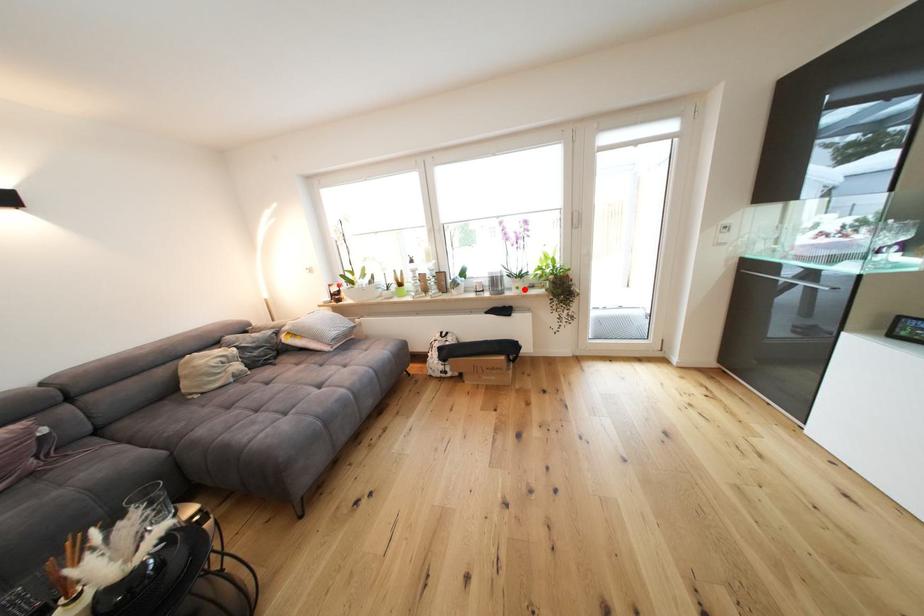
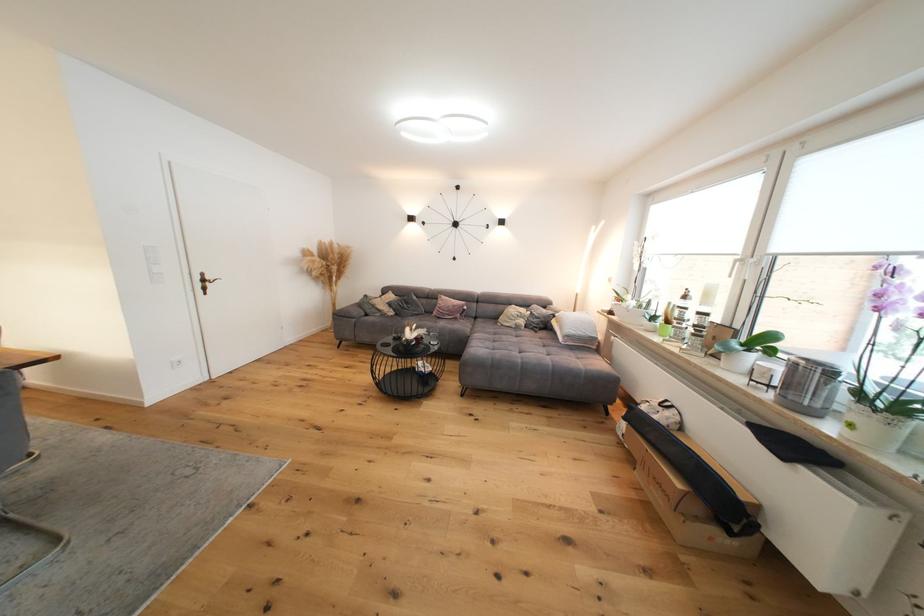
Question: I am providing you with two images of the same scene from different viewpoints. A red point is marked on the first image. Is the red point's position out of view in image 2?

Choices:
 (A) Yes
 (B) No

Answer: (B)